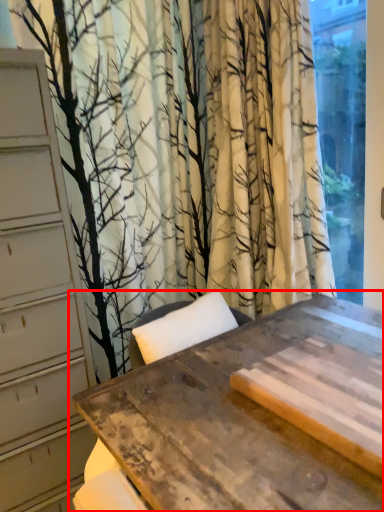
Question: Where is table (annotated by the red box) located in relation to window in the image?

Choices:
 (A) right
 (B) left

Answer: (B)